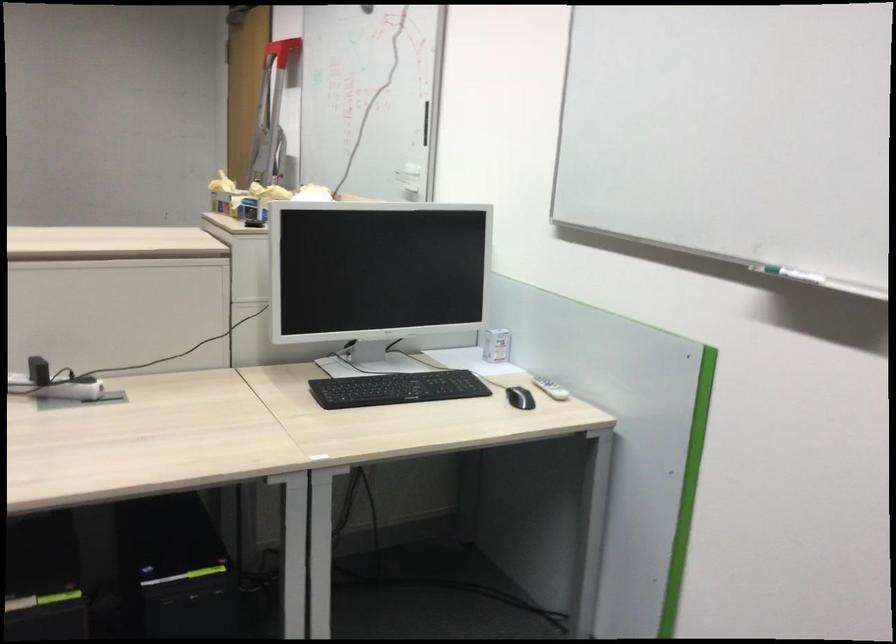
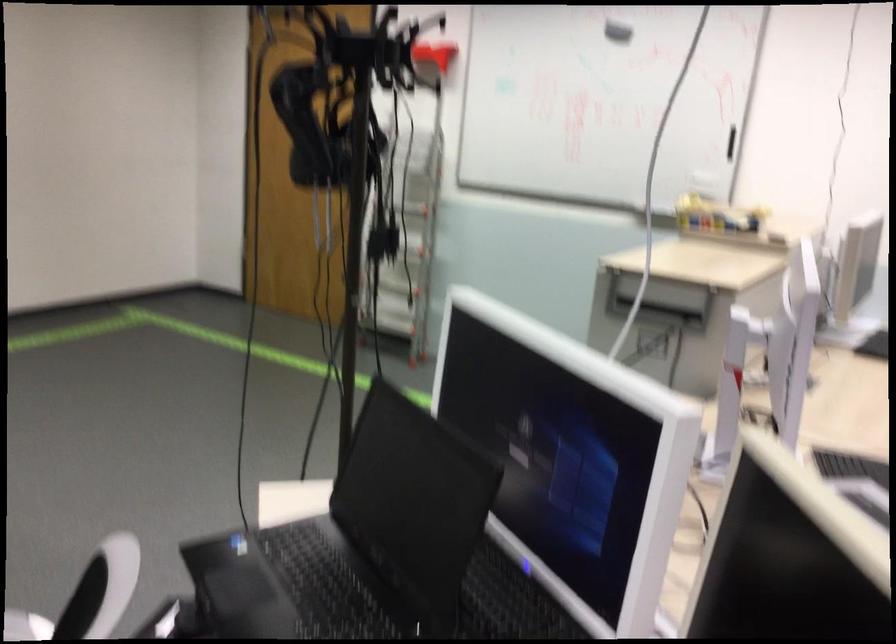
Question: In a continuous first-person perspective shot, in which direction is the camera moving?

Choices:
 (A) Left
 (B) Right
 (C) Forward
 (D) Backward

Answer: (A)